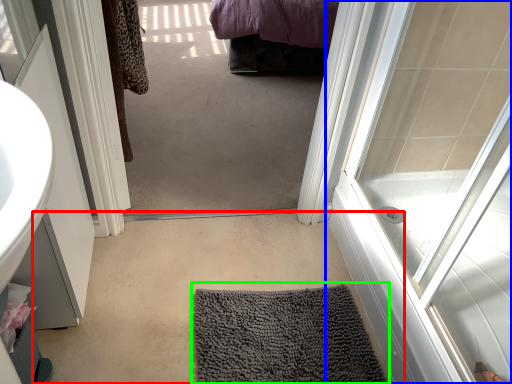
Question: Estimate the real-world distances between objects in this image. Which object is farther from plain (highlighted by a red box), door (highlighted by a blue box) or bath mat (highlighted by a green box)?

Choices:
 (A) door
 (B) bath mat

Answer: (A)